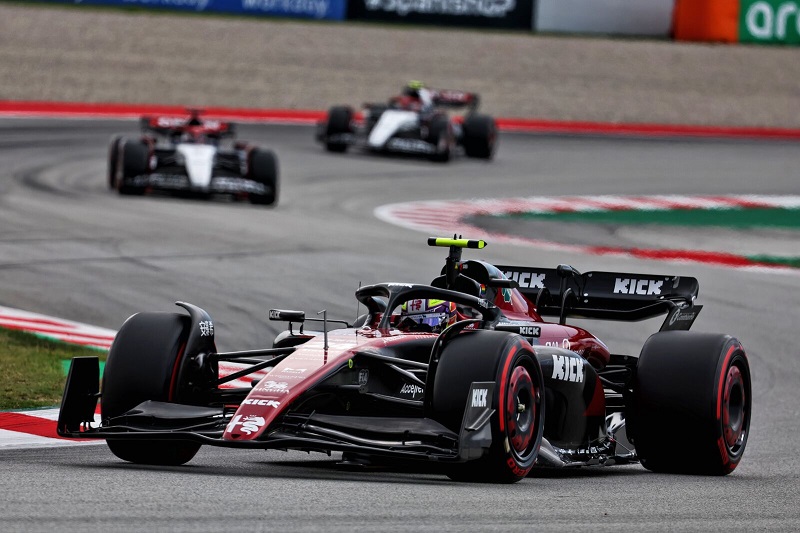
Locate an element on the screen. The height and width of the screenshot is (533, 800). hoods is located at coordinates (200, 159), (393, 121).